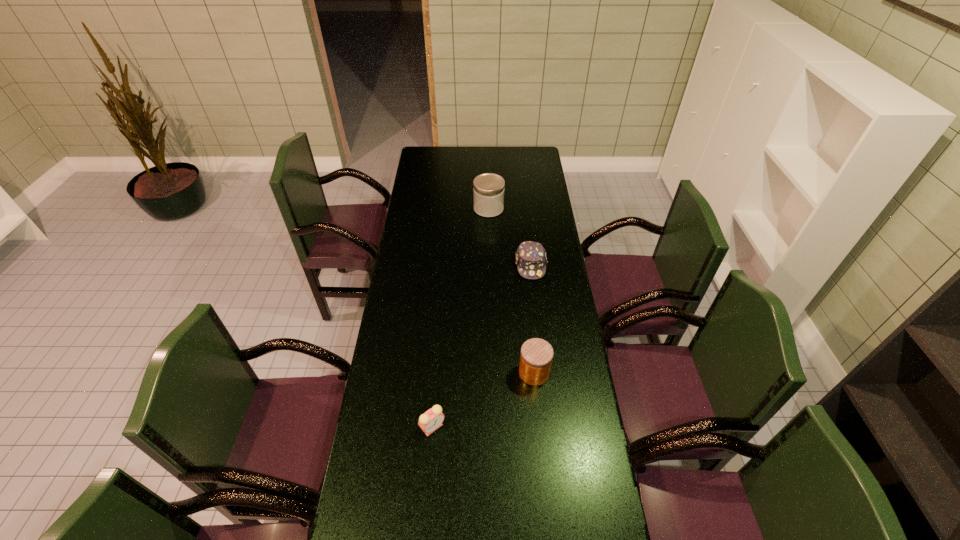
Where is `the farther jar`? The height and width of the screenshot is (540, 960). the farther jar is located at coordinates (488, 189).

Where is `the tallest object`? The image size is (960, 540). the tallest object is located at coordinates (488, 189).

Locate an element on the screen. This screenshot has height=540, width=960. the right jar is located at coordinates (536, 356).

This screenshot has height=540, width=960. I want to click on the third farthest object, so click(536, 356).

This screenshot has height=540, width=960. In order to click on the nearest object in this screenshot , I will do `click(431, 420)`.

Where is `alarm clock`? Image resolution: width=960 pixels, height=540 pixels. alarm clock is located at coordinates point(431,420).

Locate an element on the screen. The height and width of the screenshot is (540, 960). headwear is located at coordinates (531, 260).

Where is `vacant space located 0.270m on the back of the farther jar`? vacant space located 0.270m on the back of the farther jar is located at coordinates (488, 171).

The image size is (960, 540). I want to click on vacant area located 0.110m on the right of the second tallest object, so click(581, 373).

Find the location of a particular element. Image resolution: width=960 pixels, height=540 pixels. vacant point located 0.080m on the face of the alarm clock is located at coordinates (430, 464).